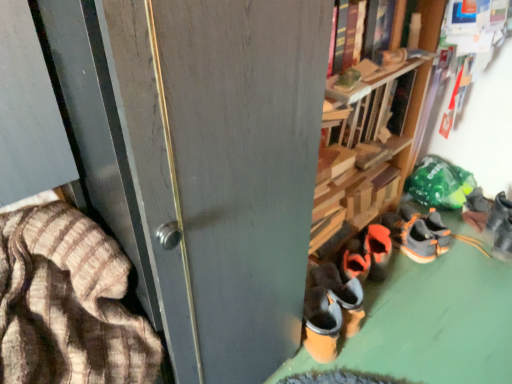
Where is `free space in front of dark brown suede shoes at lower right, which ranks as the 5th footwear in right-to-left order`? This screenshot has width=512, height=384. free space in front of dark brown suede shoes at lower right, which ranks as the 5th footwear in right-to-left order is located at coordinates (355, 364).